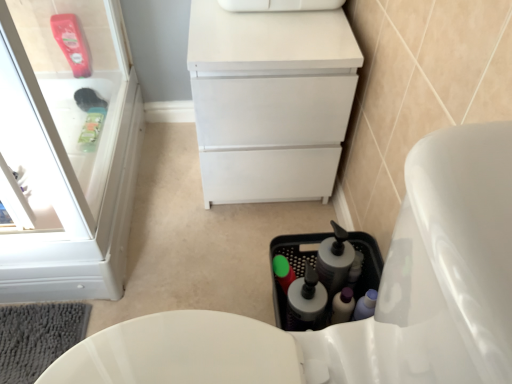
What is the approximate width of white glossy toilet at lower right?

white glossy toilet at lower right is 27.07 inches wide.

Describe the element at coordinates (66, 153) in the screenshot. I see `white plastic cabinet at upper left` at that location.

What do you see at coordinates (305, 301) in the screenshot? I see `translucent plastic bottle at lower center, the second bottle in the left-to-right sequence` at bounding box center [305, 301].

What do you see at coordinates (270, 101) in the screenshot?
I see `white matte cabinet at center` at bounding box center [270, 101].

Locate an element on the screen. Image resolution: width=512 pixels, height=384 pixels. white glossy toilet at lower right is located at coordinates (377, 300).

Are translucent plastic bottle at lower center, the first bottle in the right-to-left sequence, and white matte cabinet at center far apart?

No, translucent plastic bottle at lower center, the first bottle in the right-to-left sequence, is not far away from white matte cabinet at center.

Looking at this image, do you think translucent plastic bottle at lower center, the second bottle in the left-to-right sequence, is within white matte cabinet at center, or outside of it?

The correct answer is: outside.

From the picture: Does translucent plastic bottle at lower center, the first bottle in the right-to-left sequence, turn towards white matte cabinet at center?

No, translucent plastic bottle at lower center, the first bottle in the right-to-left sequence, is not aimed at white matte cabinet at center.

Considering the relative positions of translucent plastic bottle at lower center, the second bottle in the left-to-right sequence, and white matte cabinet at center in the image provided, is translucent plastic bottle at lower center, the second bottle in the left-to-right sequence, to the right of white matte cabinet at center from the viewer's perspective?

Yes.

Consider the image. Does green matte bottle at center, the second bottle from the right, appear on the left side of white glossy toilet at lower right?

No.

Locate an element on the screen. The height and width of the screenshot is (384, 512). toilet that appears in front of the green matte bottle at center, the second bottle from the right is located at coordinates (377, 300).

Is green matte bottle at center, the second bottle from the right, not within white glossy toilet at lower right?

Yes, green matte bottle at center, the second bottle from the right, is located beyond the bounds of white glossy toilet at lower right.

From the image's perspective, which one is positioned lower, green matte bottle at center, marked as the 1th bottle in a left-to-right arrangement, or white glossy toilet at lower right?

white glossy toilet at lower right is shown below in the image.

Which of these two, white matte cabinet at center or white plastic cabinet at upper left, is thinner?

Thinner between the two is white plastic cabinet at upper left.

Does white matte cabinet at center lie in front of white plastic cabinet at upper left?

No, the depth of white matte cabinet at center is greater than that of white plastic cabinet at upper left.

Where is `vanity below the white plastic cabinet at upper left (from a real-world perspective)`? vanity below the white plastic cabinet at upper left (from a real-world perspective) is located at coordinates click(270, 101).

How far apart are white matte cabinet at center and white plastic cabinet at upper left?

They are 45.38 centimeters apart.

From a real-world perspective, is translucent plastic bottle at lower center, the first bottle in the right-to-left sequence, positioned over white glossy toilet at lower right based on gravity?

No, from a real-world perspective, translucent plastic bottle at lower center, the first bottle in the right-to-left sequence, is not above white glossy toilet at lower right.

From the image's perspective, which is below, translucent plastic bottle at lower center, the first bottle in the right-to-left sequence, or white glossy toilet at lower right?

white glossy toilet at lower right appears lower in the image.

Is translucent plastic bottle at lower center, the second bottle in the left-to-right sequence, to the left or to the right of white glossy toilet at lower right in the image?

translucent plastic bottle at lower center, the second bottle in the left-to-right sequence, is positioned on white glossy toilet at lower right's right side.

Between point (317, 293) and point (492, 208), which one is positioned behind?

Positioned behind is point (317, 293).

Considering the sizes of translucent plastic bottle at lower center, the second bottle in the left-to-right sequence, and white plastic cabinet at upper left in the image, is translucent plastic bottle at lower center, the second bottle in the left-to-right sequence, wider or thinner than white plastic cabinet at upper left?

Clearly, translucent plastic bottle at lower center, the second bottle in the left-to-right sequence, has more width compared to white plastic cabinet at upper left.

Is translucent plastic bottle at lower center, the first bottle in the right-to-left sequence, smaller than white plastic cabinet at upper left?

Indeed, translucent plastic bottle at lower center, the first bottle in the right-to-left sequence, has a smaller size compared to white plastic cabinet at upper left.

From a real-world perspective, between translucent plastic bottle at lower center, the first bottle in the right-to-left sequence, and white plastic cabinet at upper left, who is vertically higher?

white plastic cabinet at upper left.

Can you confirm if translucent plastic bottle at lower center, the second bottle in the left-to-right sequence, is positioned to the left of white plastic cabinet at upper left?

In fact, translucent plastic bottle at lower center, the second bottle in the left-to-right sequence, is to the right of white plastic cabinet at upper left.

Which is more to the left, translucent plastic bottle at lower center, the second bottle in the left-to-right sequence, or green matte bottle at center, the second bottle from the right?

From the viewer's perspective, green matte bottle at center, the second bottle from the right, appears more on the left side.

Is the position of translucent plastic bottle at lower center, the first bottle in the right-to-left sequence, more distant than that of green matte bottle at center, the second bottle from the right?

No, translucent plastic bottle at lower center, the first bottle in the right-to-left sequence, is in front of green matte bottle at center, the second bottle from the right.

Considering the sizes of objects translucent plastic bottle at lower center, the second bottle in the left-to-right sequence, and green matte bottle at center, marked as the 1th bottle in a left-to-right arrangement, in the image provided, who is bigger, translucent plastic bottle at lower center, the second bottle in the left-to-right sequence, or green matte bottle at center, marked as the 1th bottle in a left-to-right arrangement,?

translucent plastic bottle at lower center, the second bottle in the left-to-right sequence, is bigger.

Is translucent plastic bottle at lower center, the second bottle in the left-to-right sequence, surrounding green matte bottle at center, marked as the 1th bottle in a left-to-right arrangement?

No.

In terms of height, does green matte bottle at center, the second bottle from the right, look taller or shorter compared to white plastic cabinet at upper left?

In the image, green matte bottle at center, the second bottle from the right, appears to be shorter than white plastic cabinet at upper left.

Consider the image. Is green matte bottle at center, marked as the 1th bottle in a left-to-right arrangement, placed right next to white plastic cabinet at upper left?

There is a gap between green matte bottle at center, marked as the 1th bottle in a left-to-right arrangement, and white plastic cabinet at upper left.

You are a GUI agent. You are given a task and a screenshot of the screen. Output one action in this format:
    pyautogui.click(x=<x>, y=<y>)
    Task: Click on the bathroom cabinet to the left of green matte bottle at center, marked as the 1th bottle in a left-to-right arrangement
    The height and width of the screenshot is (384, 512).
    Given the screenshot: What is the action you would take?
    pyautogui.click(x=66, y=153)

Image resolution: width=512 pixels, height=384 pixels. I want to click on the 1st bottle directly beneath the white matte cabinet at center (from a real-world perspective), so click(305, 301).

In order to click on the 2nd bottle behind when counting from the white glossy toilet at lower right in this screenshot , I will do `click(283, 272)`.

Considering their positions, is translucent plastic bottle at lower center, the second bottle in the left-to-right sequence, positioned closer to white matte cabinet at center than white plastic cabinet at upper left?

white plastic cabinet at upper left lies closer to white matte cabinet at center than the other object.

Estimate the real-world distances between objects in this image. Which object is further from white matte cabinet at center, white glossy toilet at lower right or white plastic cabinet at upper left?

The object further to white matte cabinet at center is white glossy toilet at lower right.

From the picture: When comparing their distances from white matte cabinet at center, does white glossy toilet at lower right or translucent plastic bottle at lower center, the first bottle in the right-to-left sequence, seem closer?

Among the two, translucent plastic bottle at lower center, the first bottle in the right-to-left sequence, is located nearer to white matte cabinet at center.

Based on their spatial positions, is white matte cabinet at center or white plastic cabinet at upper left closer to white glossy toilet at lower right?

The object closer to white glossy toilet at lower right is white matte cabinet at center.

Based on their spatial positions, is white glossy toilet at lower right or white matte cabinet at center further from white plastic cabinet at upper left?

white glossy toilet at lower right lies further to white plastic cabinet at upper left than the other object.

When comparing their distances from green matte bottle at center, the second bottle from the right, does white matte cabinet at center or translucent plastic bottle at lower center, the first bottle in the right-to-left sequence, seem closer?

translucent plastic bottle at lower center, the first bottle in the right-to-left sequence.

Estimate the real-world distances between objects in this image. Which object is closer to white glossy toilet at lower right, translucent plastic bottle at lower center, the second bottle in the left-to-right sequence, or green matte bottle at center, the second bottle from the right?

translucent plastic bottle at lower center, the second bottle in the left-to-right sequence, is positioned closer to the anchor white glossy toilet at lower right.

Based on their spatial positions, is white plastic cabinet at upper left or white matte cabinet at center further from translucent plastic bottle at lower center, the first bottle in the right-to-left sequence?

white plastic cabinet at upper left is positioned further to the anchor translucent plastic bottle at lower center, the first bottle in the right-to-left sequence.

Where is `bathroom cabinet positioned between white glossy toilet at lower right and green matte bottle at center, marked as the 1th bottle in a left-to-right arrangement, from near to far`? bathroom cabinet positioned between white glossy toilet at lower right and green matte bottle at center, marked as the 1th bottle in a left-to-right arrangement, from near to far is located at coordinates (66, 153).

Where is `bottle between white glossy toilet at lower right and green matte bottle at center, marked as the 1th bottle in a left-to-right arrangement, in the front-back direction`? This screenshot has width=512, height=384. bottle between white glossy toilet at lower right and green matte bottle at center, marked as the 1th bottle in a left-to-right arrangement, in the front-back direction is located at coordinates (305, 301).

Image resolution: width=512 pixels, height=384 pixels. Identify the location of vanity situated between white plastic cabinet at upper left and green matte bottle at center, the second bottle from the right, from left to right. (270, 101).

Where is `bottle between white matte cabinet at center and translucent plastic bottle at lower center, the first bottle in the right-to-left sequence, vertically`? This screenshot has width=512, height=384. bottle between white matte cabinet at center and translucent plastic bottle at lower center, the first bottle in the right-to-left sequence, vertically is located at coordinates (283, 272).